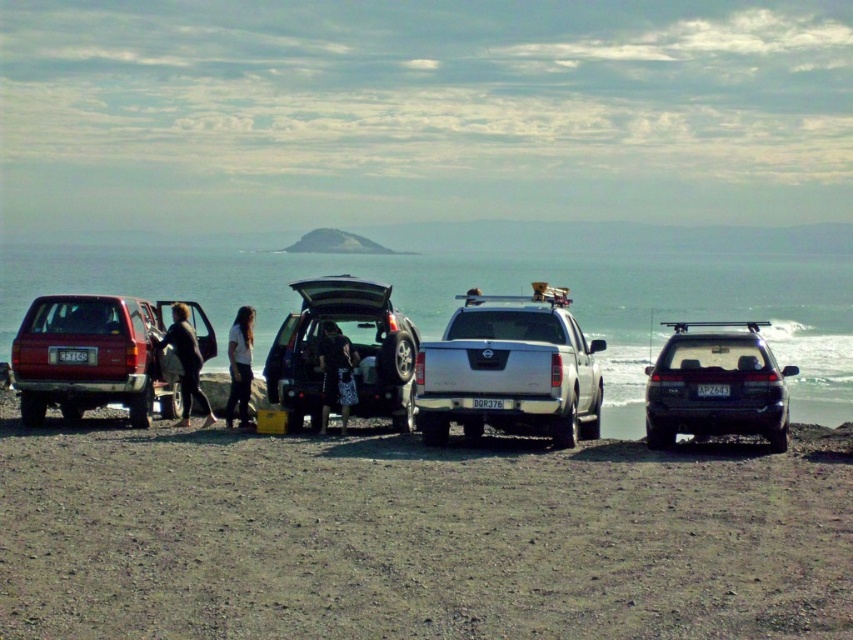
Is the position of silver metallic truck at center more distant than that of dark gray fabric bag at center?

That is False.

Between point (582, 396) and point (341, 353), which one is positioned in front?

Point (341, 353) is in front.

Where is `silver metallic truck at center`? The width and height of the screenshot is (853, 640). silver metallic truck at center is located at coordinates (509, 371).

Is brown sandy ground at lower center wider than dark gray fabric bag at center?

Indeed, brown sandy ground at lower center has a greater width compared to dark gray fabric bag at center.

Is brown sandy ground at lower center to the left of dark gray fabric bag at center from the viewer's perspective?

Incorrect, brown sandy ground at lower center is not on the left side of dark gray fabric bag at center.

Does point (747, 564) lie behind point (323, 413)?

That is False.

Where is `brown sandy ground at lower center`? brown sandy ground at lower center is located at coordinates (415, 540).

Is brown sandy ground at lower center positioned at the back of white cotton shirt at center?

No.

Image resolution: width=853 pixels, height=640 pixels. Identify the location of brown sandy ground at lower center. (415, 540).

Image resolution: width=853 pixels, height=640 pixels. In order to click on brown sandy ground at lower center in this screenshot , I will do `click(415, 540)`.